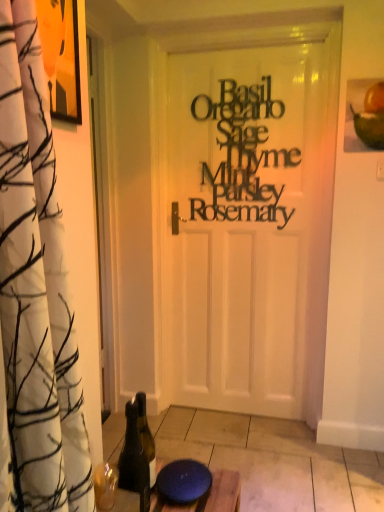
Question: Can you confirm if green glass bottle at lower left is positioned to the right of black paper sign at center?

Choices:
 (A) yes
 (B) no

Answer: (B)

Question: From the image's perspective, is green glass bottle at lower left over black paper sign at center?

Choices:
 (A) no
 (B) yes

Answer: (A)

Question: Is green glass bottle at lower left behind black paper sign at center?

Choices:
 (A) no
 (B) yes

Answer: (A)

Question: Could black paper sign at center be considered to be inside green glass bottle at lower left?

Choices:
 (A) no
 (B) yes

Answer: (A)

Question: Is green glass bottle at lower left taller than black paper sign at center?

Choices:
 (A) no
 (B) yes

Answer: (A)

Question: Is green glass bottle at lower left shorter than black paper sign at center?

Choices:
 (A) yes
 (B) no

Answer: (A)

Question: Considering the relative positions of black paper sign at center and green glass bottle at lower left in the image provided, is black paper sign at center to the left of green glass bottle at lower left from the viewer's perspective?

Choices:
 (A) no
 (B) yes

Answer: (A)

Question: Are black paper sign at center and green glass bottle at lower left making contact?

Choices:
 (A) yes
 (B) no

Answer: (B)

Question: Does black paper sign at center have a larger size compared to green glass bottle at lower left?

Choices:
 (A) yes
 (B) no

Answer: (A)

Question: Is there a large distance between black paper sign at center and green glass bottle at lower left?

Choices:
 (A) yes
 (B) no

Answer: (A)

Question: From a real-world perspective, is black paper sign at center over green glass bottle at lower left?

Choices:
 (A) no
 (B) yes

Answer: (B)

Question: Considering the relative sizes of black paper sign at center and green glass bottle at lower left in the image provided, is black paper sign at center taller than green glass bottle at lower left?

Choices:
 (A) yes
 (B) no

Answer: (A)

Question: From the image's perspective, is green glass bottle at lower left positioned above or below black paper sign at center?

Choices:
 (A) above
 (B) below

Answer: (B)